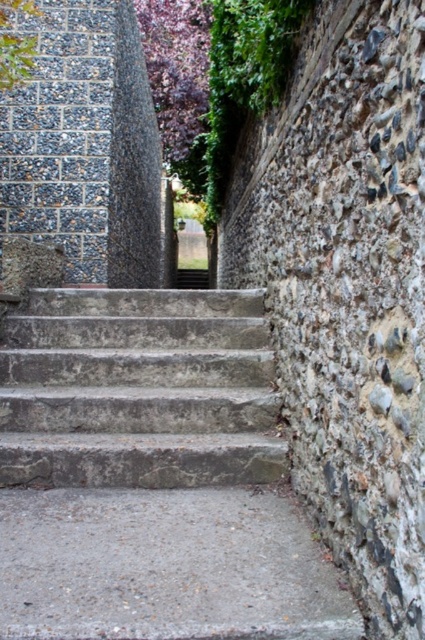
Consider the image. Who is more distant from viewer, (141, 346) or (107, 376)?

The point (141, 346) is behind.

Image resolution: width=425 pixels, height=640 pixels. What do you see at coordinates (152, 476) in the screenshot?
I see `gray concrete stairs at center` at bounding box center [152, 476].

I want to click on gray concrete stairs at center, so click(x=152, y=476).